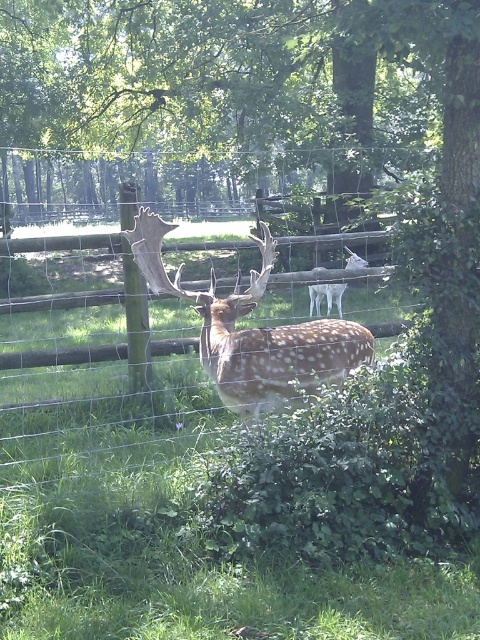
You are a wildlife photographer aiming to capture the spotted fur antlers at center through the wire mesh fence at center. Will the fence obstruct your view of the antlers?

The wire mesh fence at center is thinner than the spotted fur antlers at center, so the fence will not fully obstruct the view of the antlers since it is narrower.

You are a wildlife photographer trying to capture a clear shot of the wire mesh fence at center and the spotted fur antlers at center. Based on their sizes in the image, which object would you need to move closer to in order to focus on it properly?

The wire mesh fence at center occupies less space than the spotted fur antlers at center, so you would need to move closer to the wire mesh fence at center to focus on it properly.